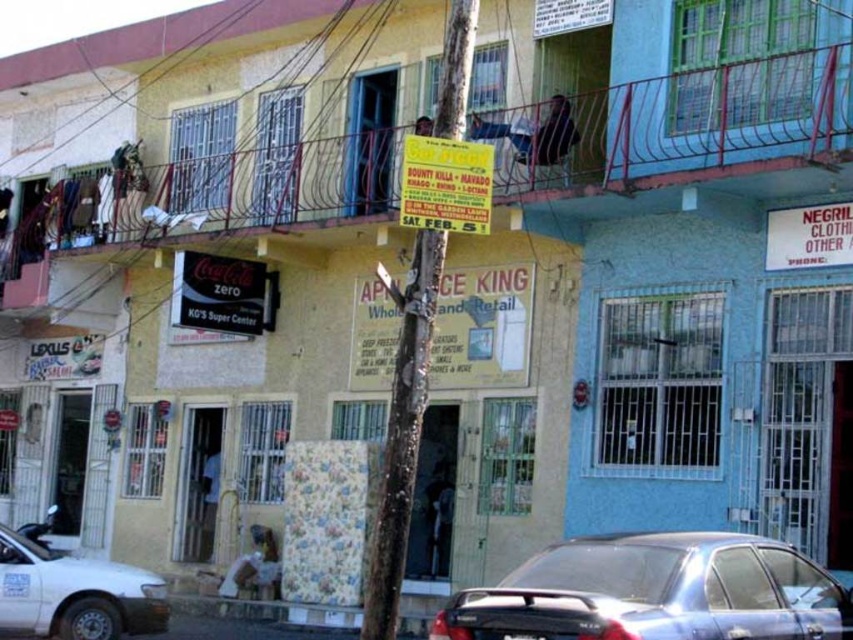
Between metallic blue sedan at lower center and white matte car at lower left, which one has less height?

Standing shorter between the two is metallic blue sedan at lower center.

At what (x,y) coordinates should I click in order to perform the action: click on metallic blue sedan at lower center. Please return your answer as a coordinate pair (x, y). This screenshot has width=853, height=640. Looking at the image, I should click on (654, 593).